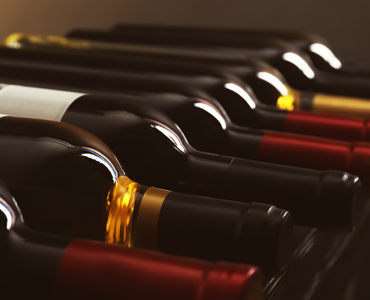
You are a GUI agent. You are given a task and a screenshot of the screen. Output one action in this format:
    pyautogui.click(x=<x>, y=<y>)
    Task: Click on the wine bottle
    The height and width of the screenshot is (300, 370).
    Given the screenshot: What is the action you would take?
    pyautogui.click(x=81, y=178), pyautogui.click(x=123, y=137), pyautogui.click(x=208, y=115), pyautogui.click(x=232, y=95), pyautogui.click(x=264, y=85), pyautogui.click(x=297, y=62), pyautogui.click(x=323, y=47)